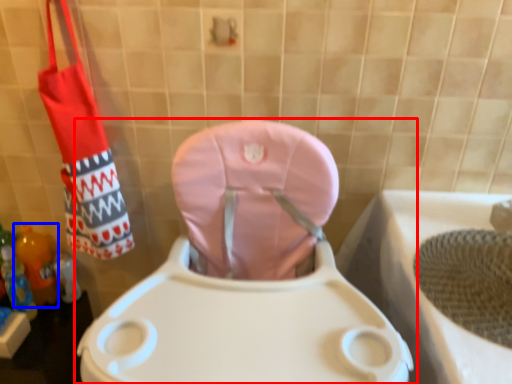
Question: Which of the following is the closest to the observer, toilet (highlighted by a red box) or bottle (highlighted by a blue box)?

Choices:
 (A) toilet
 (B) bottle

Answer: (A)